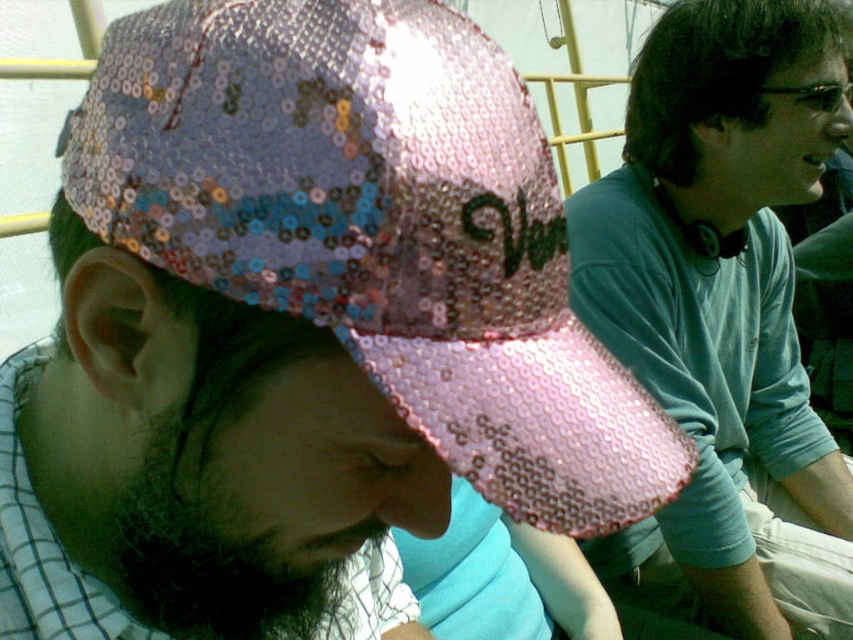
Question: Observing the image, what is the correct spatial positioning of pink sequined baseball cap at center in reference to pink sequined cap at upper left?

Choices:
 (A) above
 (B) below

Answer: (A)

Question: From the image, what is the correct spatial relationship of pink sequined cap at upper left in relation to dark brown fuzzy beard at lower left?

Choices:
 (A) right
 (B) left

Answer: (A)

Question: Is pink sequined cap at upper left wider than dark brown fuzzy beard at lower left?

Choices:
 (A) yes
 (B) no

Answer: (A)

Question: Which object is positioned farthest from the pink sequined cap at upper left?

Choices:
 (A) pink sequined baseball cap at center
 (B) dark brown fuzzy beard at lower left

Answer: (A)

Question: Among these points, which one is nearest to the camera?

Choices:
 (A) coord(155,545)
 (B) coord(341,29)
 (C) coord(802,128)

Answer: (B)

Question: Based on their relative distances, which object is nearer to the dark brown fuzzy beard at lower left?

Choices:
 (A) pink sequined cap at upper left
 (B) pink sequined baseball cap at center

Answer: (B)